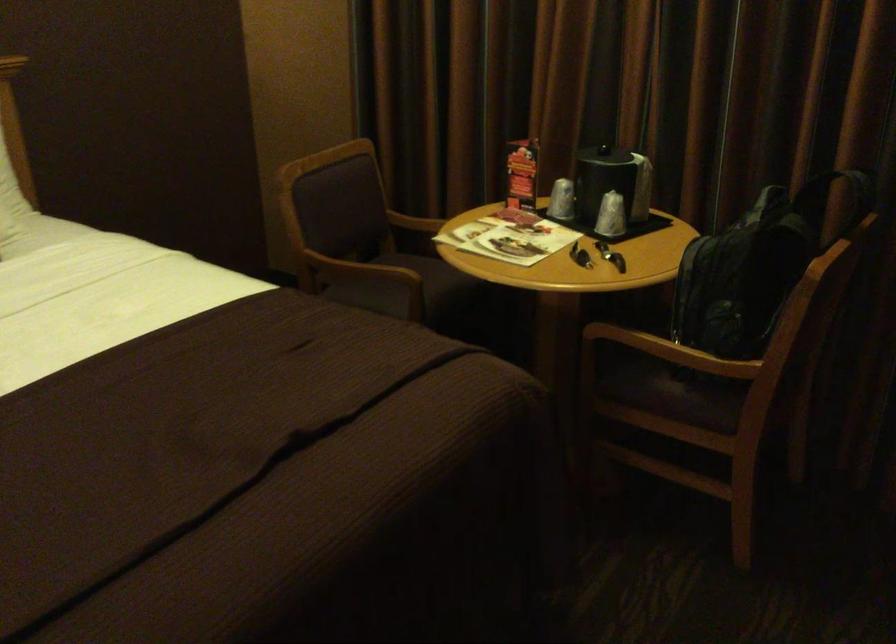
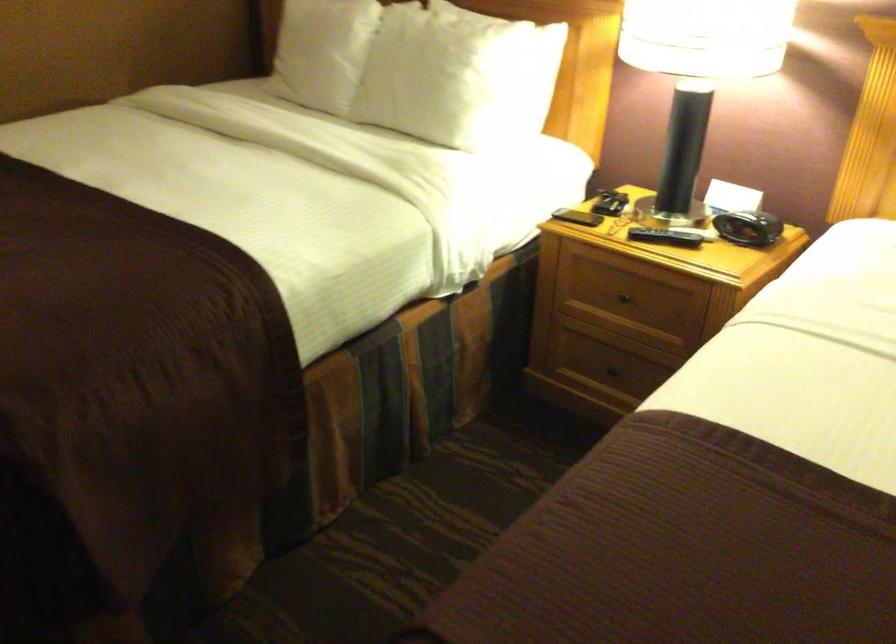
First-person continuous shooting, in which direction is the camera rotating?

The camera rotated toward left-down.